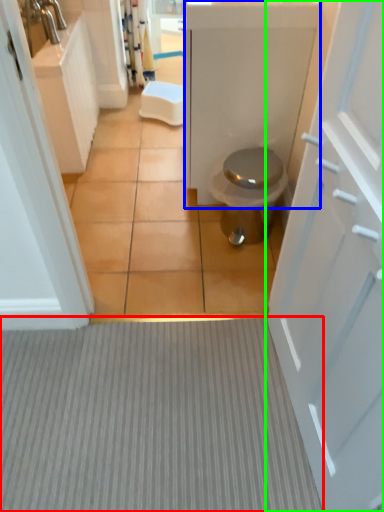
Question: Which is farther away from plain (highlighted by a red box)? bath (highlighted by a blue box) or door (highlighted by a green box)?

Choices:
 (A) bath
 (B) door

Answer: (A)